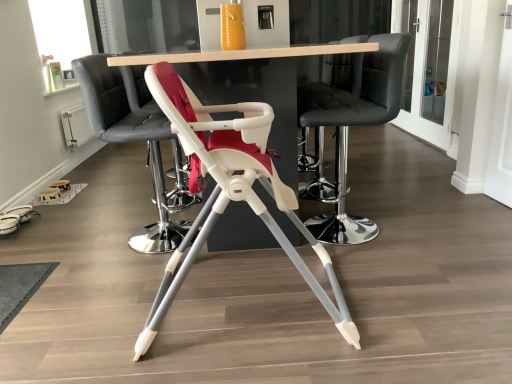
Locate an element on the screen. The height and width of the screenshot is (384, 512). vacant location below white plastic highchair at center, positioned as the fourth chair in back-to-front order (from a real-world perspective) is located at coordinates (250, 303).